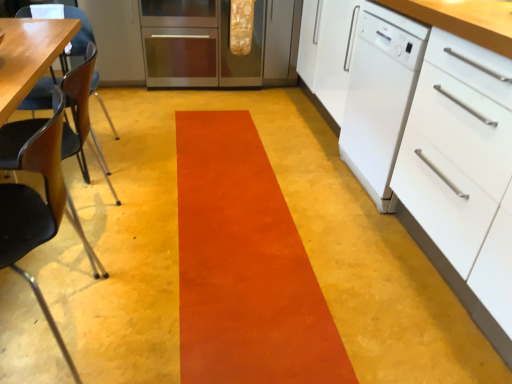
Question: Is white glossy dishwasher at right surrounded by stainless steel oven at center?

Choices:
 (A) yes
 (B) no

Answer: (B)

Question: From the image's perspective, is stainless steel oven at center under white glossy dishwasher at right?

Choices:
 (A) yes
 (B) no

Answer: (B)

Question: Can you confirm if stainless steel oven at center is taller than white glossy dishwasher at right?

Choices:
 (A) no
 (B) yes

Answer: (A)

Question: Considering the relative sizes of stainless steel oven at center and white glossy dishwasher at right in the image provided, is stainless steel oven at center wider than white glossy dishwasher at right?

Choices:
 (A) yes
 (B) no

Answer: (B)

Question: Is stainless steel oven at center closer to camera compared to white glossy dishwasher at right?

Choices:
 (A) no
 (B) yes

Answer: (A)

Question: In the image, is white matte drawer at right positioned in front of or behind orange suede rug at center?

Choices:
 (A) behind
 (B) front

Answer: (B)

Question: Based on their positions, is white matte drawer at right located to the left or right of orange suede rug at center?

Choices:
 (A) left
 (B) right

Answer: (B)

Question: Looking at their shapes, would you say white matte drawer at right is wider or thinner than orange suede rug at center?

Choices:
 (A) wide
 (B) thin

Answer: (B)

Question: Considering the positions of white matte drawer at right and orange suede rug at center in the image, is white matte drawer at right bigger or smaller than orange suede rug at center?

Choices:
 (A) big
 (B) small

Answer: (A)

Question: Considering the positions of white glossy dishwasher at right and black plastic chair at left, the 2th chair positioned from the back, in the image, is white glossy dishwasher at right wider or thinner than black plastic chair at left, the 2th chair positioned from the back,?

Choices:
 (A) wide
 (B) thin

Answer: (A)

Question: Would you say white glossy dishwasher at right is to the left or to the right of black plastic chair at left, the 2th chair positioned from the back, in the picture?

Choices:
 (A) left
 (B) right

Answer: (B)

Question: Relative to black plastic chair at left, acting as the first chair starting from the front, is white glossy dishwasher at right in front or behind?

Choices:
 (A) front
 (B) behind

Answer: (B)

Question: From a real-world perspective, is white glossy dishwasher at right physically located above or below black plastic chair at left, acting as the first chair starting from the front?

Choices:
 (A) above
 (B) below

Answer: (A)

Question: Is wooden chair at left, which is the 1th chair in back-to-front order, taller or shorter than stainless steel oven at center?

Choices:
 (A) short
 (B) tall

Answer: (B)

Question: From the image's perspective, is wooden chair at left, the 2th chair from the front, positioned above or below stainless steel oven at center?

Choices:
 (A) above
 (B) below

Answer: (B)